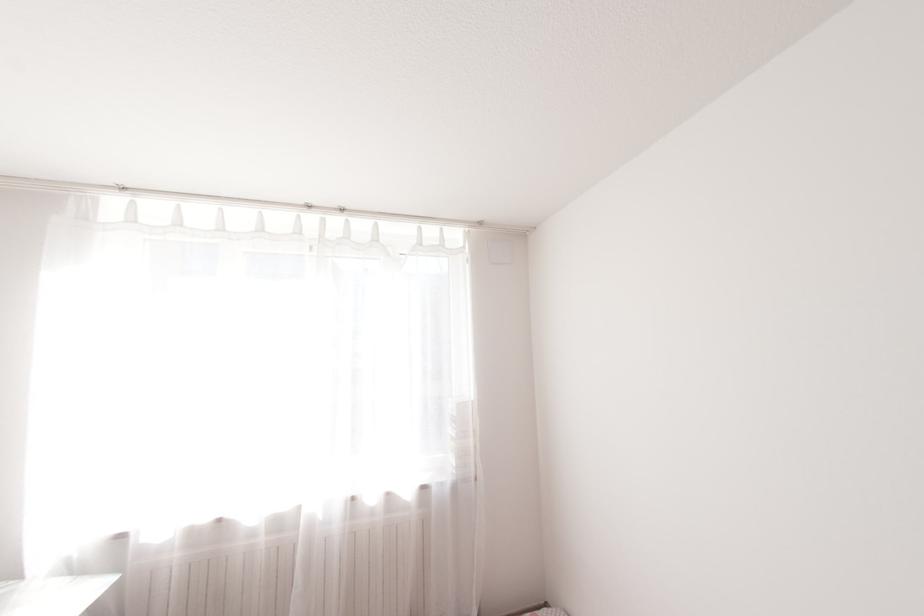
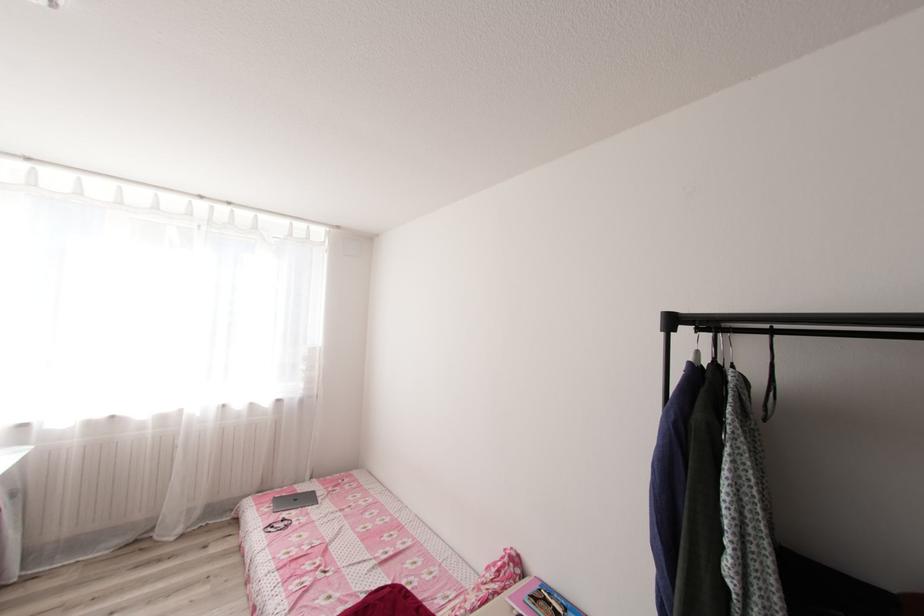
Question: Which direction would the cameraman need to move to produce the second image? Reply with the corresponding letter.

Choices:
 (A) Left
 (B) Right
 (C) Forward
 (D) Backward

Answer: (D)